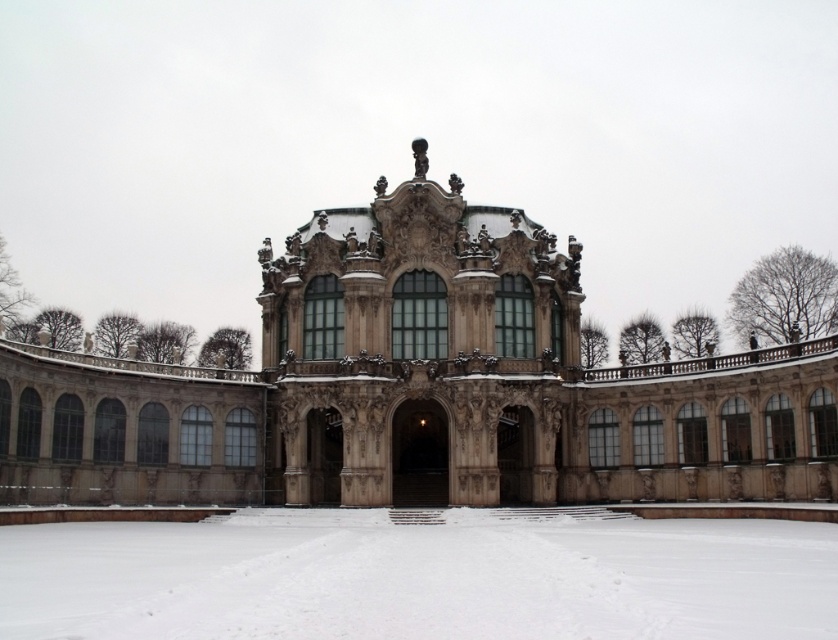
You are a photographer planning to take a picture of the brown stone palace at center and the white powdery snow at center. Based on their sizes, which one should you focus on to ensure it occupies more space in the photo?

The brown stone palace at center is larger in size than the white powdery snow at center, so focusing on it will ensure it occupies more space in the photo.

You are planning to take a photo of the brown stone palace at center and the white powdery snow at center. Which object should you focus on first if you want to capture both in a single frame without moving the camera?

The brown stone palace at center should be focused on first because its width is larger than the white powdery snow at center, so it requires more attention to fit both in the frame.

You are planning to take a photo of the brown stone palace at center and the white powdery snow at center from the front. Which object should you focus on first if you want to capture both in a single shot without moving the camera?

The brown stone palace at center is taller than the white powdery snow at center, so you should focus on the brown stone palace at center first to ensure it fits within the frame.